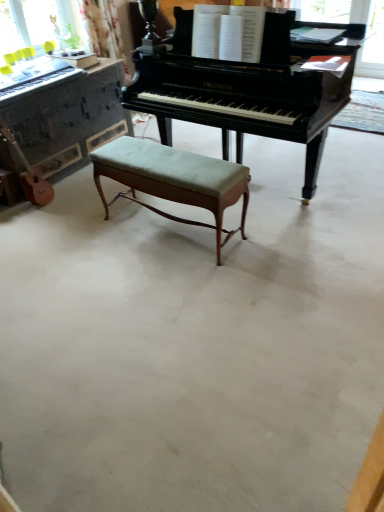
Question: From the image's perspective, does light brown wood guitar at left appear lower than glossy black piano at center, the first piano positioned from the right?

Choices:
 (A) no
 (B) yes

Answer: (B)

Question: From the image's perspective, is light brown wood guitar at left on glossy black piano at center, the first piano positioned from the right?

Choices:
 (A) no
 (B) yes

Answer: (A)

Question: Can you confirm if light brown wood guitar at left is positioned to the right of glossy black piano at center, marked as the second piano in a left-to-right arrangement?

Choices:
 (A) no
 (B) yes

Answer: (A)

Question: Does light brown wood guitar at left turn towards glossy black piano at center, marked as the second piano in a left-to-right arrangement?

Choices:
 (A) yes
 (B) no

Answer: (B)

Question: Considering the relative sizes of light brown wood guitar at left and glossy black piano at center, marked as the second piano in a left-to-right arrangement, in the image provided, is light brown wood guitar at left taller than glossy black piano at center, marked as the second piano in a left-to-right arrangement,?

Choices:
 (A) yes
 (B) no

Answer: (B)

Question: Does light brown wood guitar at left have a larger size compared to glossy black piano at center, marked as the second piano in a left-to-right arrangement?

Choices:
 (A) yes
 (B) no

Answer: (B)

Question: Is green fabric stool at center shorter than polished dark wood piano at center, which is the first piano from left to right?

Choices:
 (A) yes
 (B) no

Answer: (A)

Question: From the image's perspective, would you say green fabric stool at center is positioned over polished dark wood piano at center, which is the first piano from left to right?

Choices:
 (A) no
 (B) yes

Answer: (A)

Question: Can you confirm if green fabric stool at center is taller than polished dark wood piano at center, which is the first piano from left to right?

Choices:
 (A) yes
 (B) no

Answer: (B)

Question: Is green fabric stool at center far away from polished dark wood piano at center, the second piano when ordered from right to left?

Choices:
 (A) yes
 (B) no

Answer: (B)

Question: Is the position of green fabric stool at center more distant than that of polished dark wood piano at center, the second piano when ordered from right to left?

Choices:
 (A) yes
 (B) no

Answer: (B)

Question: Can you confirm if green fabric stool at center is wider than polished dark wood piano at center, the second piano when ordered from right to left?

Choices:
 (A) yes
 (B) no

Answer: (B)

Question: Can you confirm if polished dark wood piano at center, which is the first piano from left to right, is thinner than green fabric stool at center?

Choices:
 (A) yes
 (B) no

Answer: (B)